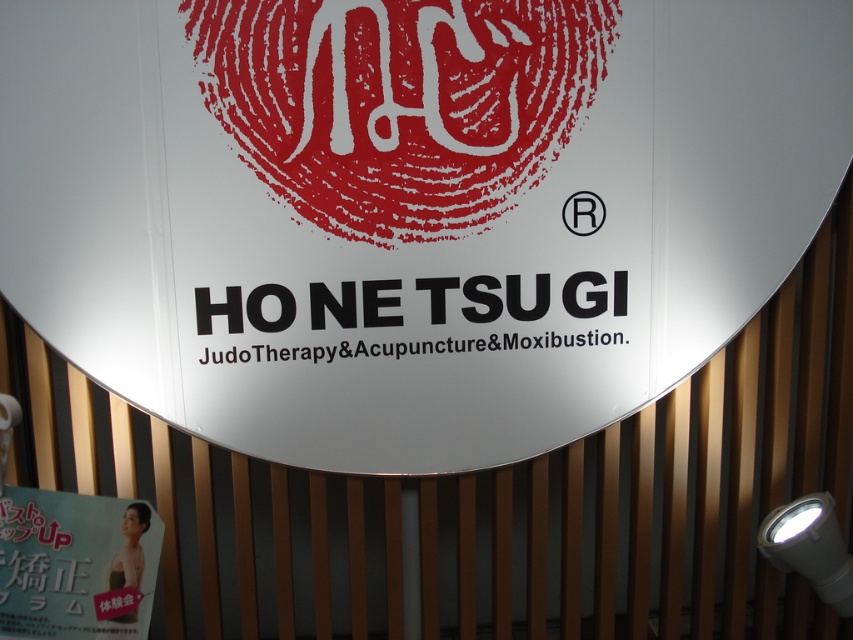
Question: Estimate the real-world distances between objects in this image. Which object is farther from the black registered trademark symbol at upper center?

Choices:
 (A) white plastic spotlight at lower right
 (B) white glossy sign at center
 (C) white glossy poster at lower left
 (D) white matte logo at upper center

Answer: (C)

Question: Which point is farther from the camera taking this photo?

Choices:
 (A) (74, 604)
 (B) (291, 141)
 (C) (840, 560)
 (D) (321, 384)

Answer: (C)

Question: Is white glossy sign at center thinner than white matte logo at upper center?

Choices:
 (A) yes
 (B) no

Answer: (B)

Question: Which point is closer to the camera?

Choices:
 (A) (252, 161)
 (B) (190, 96)

Answer: (B)

Question: Can you confirm if white glossy sign at center is bigger than white matte logo at upper center?

Choices:
 (A) no
 (B) yes

Answer: (B)

Question: Is white glossy poster at lower left positioned before white plastic spotlight at lower right?

Choices:
 (A) no
 (B) yes

Answer: (B)